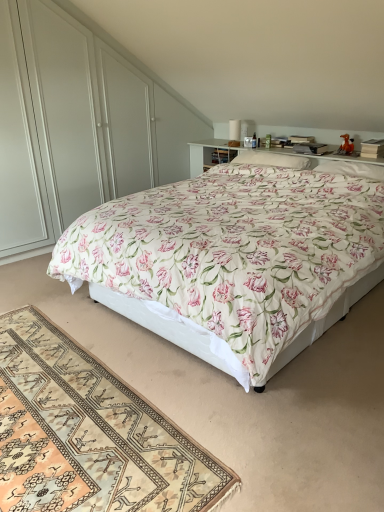
Identify the location of beige woven rug at lower left. This screenshot has height=512, width=384. (89, 433).

What is the approximate height of white soft pillow at upper right, the 2th pillow when ordered from left to right?

It is 10.42 centimeters.

This screenshot has height=512, width=384. In order to click on white glossy dresser at upper center in this screenshot , I will do `click(78, 125)`.

Where is `floral cotton bed at center`? The image size is (384, 512). floral cotton bed at center is located at coordinates (232, 261).

Can you see white glossy dresser at upper center touching beige woven rug at lower left?

No, white glossy dresser at upper center is not in contact with beige woven rug at lower left.

Considering the relative positions of white glossy dresser at upper center and beige woven rug at lower left in the image provided, is white glossy dresser at upper center behind beige woven rug at lower left?

That is True.

Considering the relative sizes of white glossy dresser at upper center and beige woven rug at lower left in the image provided, is white glossy dresser at upper center wider than beige woven rug at lower left?

Incorrect, the width of white glossy dresser at upper center does not surpass that of beige woven rug at lower left.

Considering the sizes of objects white soft pillow at center, the 1th pillow viewed from the left, and floral cotton bed at center in the image provided, who is smaller, white soft pillow at center, the 1th pillow viewed from the left, or floral cotton bed at center?

With smaller size is white soft pillow at center, the 1th pillow viewed from the left.

How different are the orientations of white soft pillow at center, the 1th pillow viewed from the left, and floral cotton bed at center in degrees?

The angular difference between white soft pillow at center, the 1th pillow viewed from the left, and floral cotton bed at center is 0.00137 degrees.

From the image's perspective, who appears lower, white soft pillow at center, the 2th pillow viewed from the right, or floral cotton bed at center?

floral cotton bed at center appears lower in the image.

Is white soft pillow at center, the 1th pillow viewed from the left, turned away from floral cotton bed at center?

Yes, white soft pillow at center, the 1th pillow viewed from the left, is facing away from floral cotton bed at center.

Can you confirm if floral cotton bed at center is positioned to the right of white glossy dresser at upper center?

Yes, floral cotton bed at center is to the right of white glossy dresser at upper center.

Considering the sizes of objects floral cotton bed at center and white glossy dresser at upper center in the image provided, who is wider, floral cotton bed at center or white glossy dresser at upper center?

floral cotton bed at center is wider.

Where is `dresser above the floral cotton bed at center (from a real-world perspective)`? This screenshot has width=384, height=512. dresser above the floral cotton bed at center (from a real-world perspective) is located at coordinates (78, 125).

Relative to white glossy dresser at upper center, is floral cotton bed at center in front or behind?

Visually, floral cotton bed at center is located in front of white glossy dresser at upper center.

From the image's perspective, would you say floral cotton bed at center is shown under white soft pillow at upper right, the 2th pillow when ordered from left to right?

Correct, floral cotton bed at center appears lower than white soft pillow at upper right, the 2th pillow when ordered from left to right, in the image.

In the scene shown: Is floral cotton bed at center aimed at white soft pillow at upper right, the 2th pillow when ordered from left to right?

No, floral cotton bed at center does not turn towards white soft pillow at upper right, the 2th pillow when ordered from left to right.

Which is correct: floral cotton bed at center is inside white soft pillow at upper right, the 2th pillow when ordered from left to right, or outside of it?

floral cotton bed at center is not enclosed by white soft pillow at upper right, the 2th pillow when ordered from left to right.

Considering their positions, is floral cotton bed at center located in front of or behind white soft pillow at upper right, the 2th pillow when ordered from left to right?

Clearly, floral cotton bed at center is in front of white soft pillow at upper right, the 2th pillow when ordered from left to right.

Which is behind, white soft pillow at upper right, the 1th pillow from the right, or white glossy dresser at upper center?

Positioned behind is white soft pillow at upper right, the 1th pillow from the right.

Are white soft pillow at upper right, the 1th pillow from the right, and white glossy dresser at upper center far apart?

Indeed, white soft pillow at upper right, the 1th pillow from the right, is not near white glossy dresser at upper center.

Is white soft pillow at upper right, the 1th pillow from the right, wider or thinner than white glossy dresser at upper center?

Clearly, white soft pillow at upper right, the 1th pillow from the right, has more width compared to white glossy dresser at upper center.

This screenshot has width=384, height=512. In order to click on mat located underneath the floral cotton bed at center (from a real-world perspective) in this screenshot , I will do `click(89, 433)`.

From the image's perspective, is floral cotton bed at center below beige woven rug at lower left?

No, from the image's perspective, floral cotton bed at center is not below beige woven rug at lower left.

Which object is thinner, floral cotton bed at center or beige woven rug at lower left?

With smaller width is beige woven rug at lower left.

Which of these two, floral cotton bed at center or beige woven rug at lower left, stands taller?

floral cotton bed at center is taller.

Considering the relative positions of white soft pillow at center, the 2th pillow viewed from the right, and beige woven rug at lower left in the image provided, is white soft pillow at center, the 2th pillow viewed from the right, to the right of beige woven rug at lower left from the viewer's perspective?

Indeed, white soft pillow at center, the 2th pillow viewed from the right, is positioned on the right side of beige woven rug at lower left.

From the image's perspective, between white soft pillow at center, the 2th pillow viewed from the right, and beige woven rug at lower left, who is located below?

beige woven rug at lower left is shown below in the image.

Which pillow is the 2nd one when counting from the back of the beige woven rug at lower left? Please provide its 2D coordinates.

[(272, 159)]

The width and height of the screenshot is (384, 512). I want to click on mat in front of the white glossy dresser at upper center, so click(89, 433).

I want to click on pillow that is the 2nd one when counting upward from the floral cotton bed at center (from the image's perspective), so (272, 159).

When comparing their distances from white soft pillow at upper right, the 2th pillow when ordered from left to right, does floral cotton bed at center or beige woven rug at lower left seem closer?

Based on the image, floral cotton bed at center appears to be nearer to white soft pillow at upper right, the 2th pillow when ordered from left to right.

Looking at the image, which one is located closer to beige woven rug at lower left, white glossy dresser at upper center or white soft pillow at upper right, the 2th pillow when ordered from left to right?

white glossy dresser at upper center lies closer to beige woven rug at lower left than the other object.

Estimate the real-world distances between objects in this image. Which object is closer to white soft pillow at center, the 1th pillow viewed from the left, floral cotton bed at center or beige woven rug at lower left?

floral cotton bed at center lies closer to white soft pillow at center, the 1th pillow viewed from the left, than the other object.

Based on their spatial positions, is beige woven rug at lower left or white glossy dresser at upper center further from white soft pillow at upper right, the 1th pillow from the right?

beige woven rug at lower left.

When comparing their distances from white glossy dresser at upper center, does white soft pillow at upper right, the 2th pillow when ordered from left to right, or white soft pillow at center, the 1th pillow viewed from the left, seem further?

The object further to white glossy dresser at upper center is white soft pillow at upper right, the 2th pillow when ordered from left to right.

From the picture: From the image, which object appears to be farther from beige woven rug at lower left, white soft pillow at upper right, the 2th pillow when ordered from left to right, or white glossy dresser at upper center?

The object further to beige woven rug at lower left is white soft pillow at upper right, the 2th pillow when ordered from left to right.

Looking at the image, which one is located further to white soft pillow at upper right, the 2th pillow when ordered from left to right, white soft pillow at center, the 2th pillow viewed from the right, or white glossy dresser at upper center?

white glossy dresser at upper center.

From the image, which object appears to be farther from beige woven rug at lower left, floral cotton bed at center or white soft pillow at center, the 2th pillow viewed from the right?

The object further to beige woven rug at lower left is white soft pillow at center, the 2th pillow viewed from the right.

This screenshot has width=384, height=512. I want to click on bed located between beige woven rug at lower left and white soft pillow at center, the 1th pillow viewed from the left, in the depth direction, so (232, 261).

Identify the location of bed between white glossy dresser at upper center and beige woven rug at lower left vertically. Image resolution: width=384 pixels, height=512 pixels. (232, 261).

You are a GUI agent. You are given a task and a screenshot of the screen. Output one action in this format:
    pyautogui.click(x=<x>, y=<y>)
    Task: Click on the pillow located between beige woven rug at lower left and white soft pillow at center, the 2th pillow viewed from the right, in the depth direction
    
    Given the screenshot: What is the action you would take?
    pyautogui.click(x=352, y=169)

Identify the location of dresser between beige woven rug at lower left and white soft pillow at center, the 1th pillow viewed from the left, in the front-back direction. This screenshot has width=384, height=512. (78, 125).